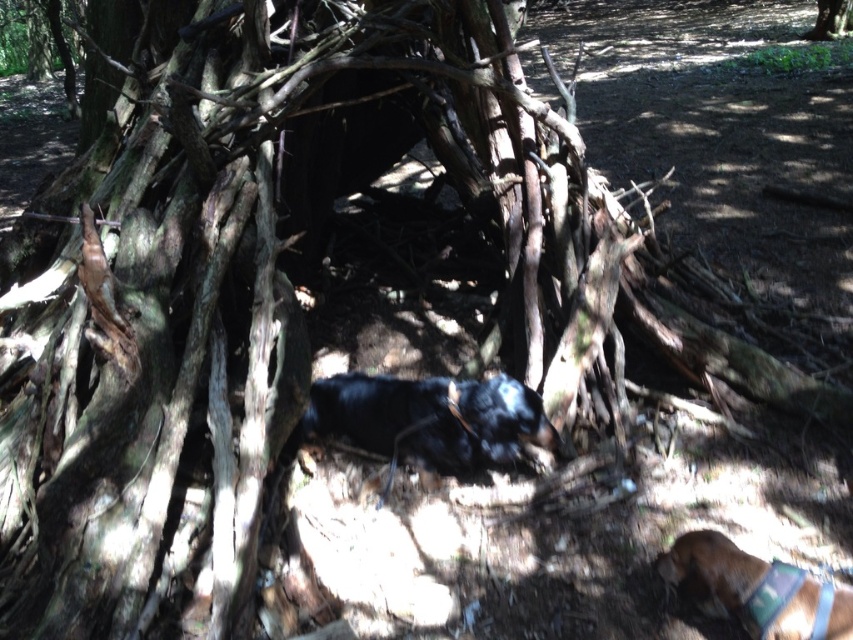
You are standing at the point marked by the coordinates point (431, 419) in the image. What object is located at this point?

The point (431, 419) indicates the location of the black fur dog at center.

From the picture: You are a hiker who wants to know which dog is closer to the shelter. You see the black fur dog at center and the brown fabric dog at lower right. Which one is closer to the shelter?

The brown fabric dog at lower right is closer to the shelter because it is positioned at lower right, which is near the shelter, while the black fur dog at center is farther away.

You are standing at the origin point of the coordinate system where the shelter is located. The black fur dog at center is at point 0.656, 0.506. If you want to walk towards the dog, in which general direction should you move?

The black fur dog at center is located at coordinates (431, 419), which means it is positioned to the northeast of your current position at the origin. Therefore, you should move in a northeast direction to reach the dog.